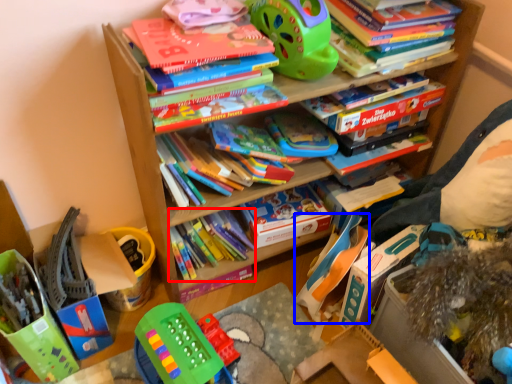
Question: Which object appears farthest to the camera in this image, book (highlighted by a red box) or toy (highlighted by a blue box)?

Choices:
 (A) book
 (B) toy

Answer: (A)